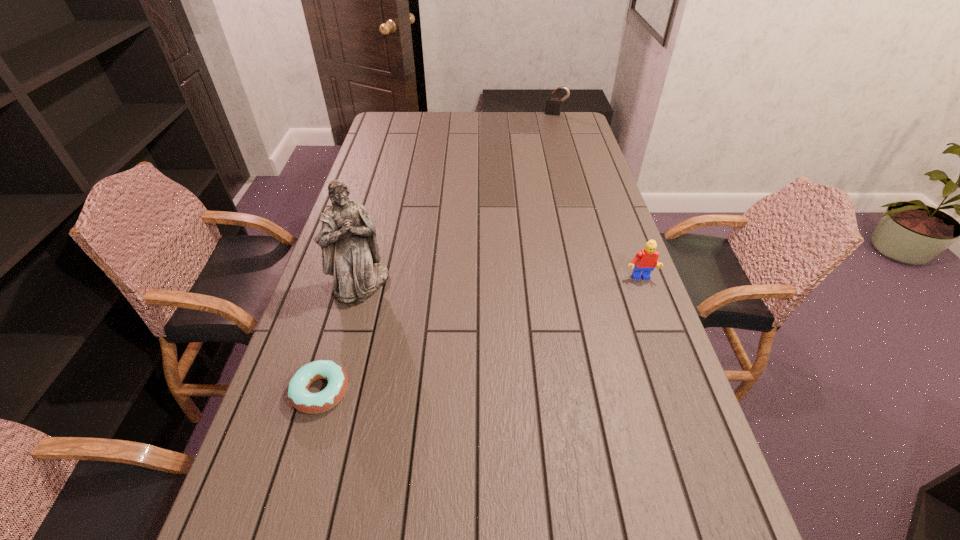
In the image, there is a desktop. Where is `vacant space at the far edge`? vacant space at the far edge is located at coordinates (543, 117).

Locate an element on the screen. vacant space at the near edge of the desktop is located at coordinates (386, 484).

The width and height of the screenshot is (960, 540). In order to click on vacant area at the left edge in this screenshot , I will do `click(314, 454)`.

Locate an element on the screen. This screenshot has width=960, height=540. vacant area at the right edge of the desktop is located at coordinates (636, 359).

Identify the location of free region at the far left corner of the desktop. (396, 130).

At what (x,y) coordinates should I click in order to perform the action: click on vacant space at the far right corner. Please return your answer as a coordinate pair (x, y). Looking at the image, I should click on (571, 131).

In order to click on blank region between the tallest object and the shortest object in this screenshot , I will do `click(341, 338)`.

Locate an element on the screen. free space between the Lego and the doughnut is located at coordinates (x=480, y=335).

Find the location of a particular element. Image resolution: width=960 pixels, height=540 pixels. vacant area that lies between the rightmost object and the doughnut is located at coordinates (480, 335).

At what (x,y) coordinates should I click in order to perform the action: click on free space that is in between the Lego and the farthest object. Please return your answer as a coordinate pair (x, y). Looking at the image, I should click on (597, 196).